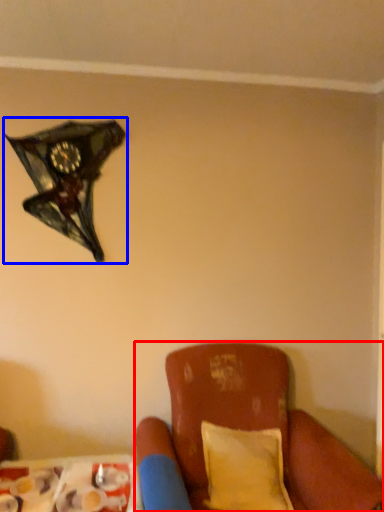
Question: Which point is closer to the camera, furniture (highlighted by a red box) or lamp (highlighted by a blue box)?

Choices:
 (A) furniture
 (B) lamp

Answer: (A)